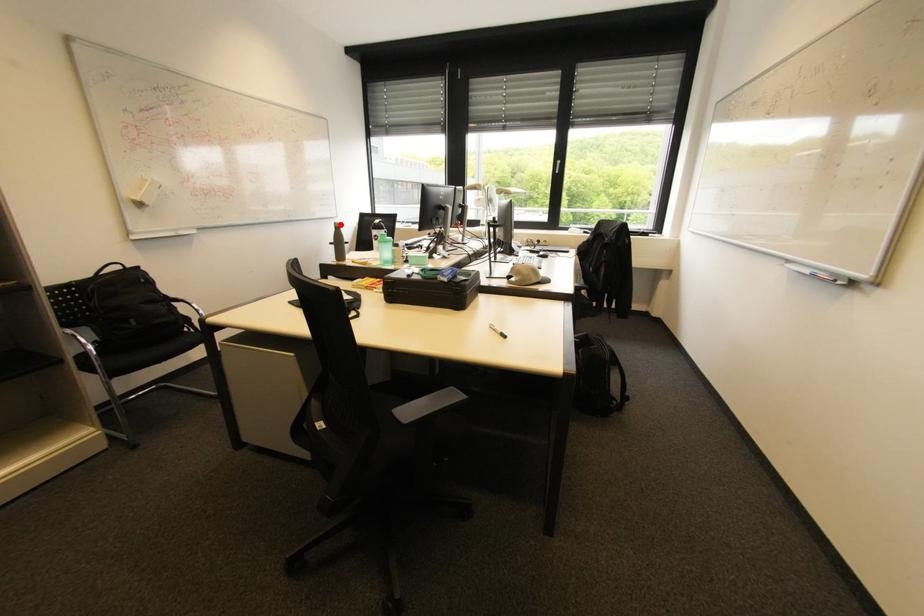
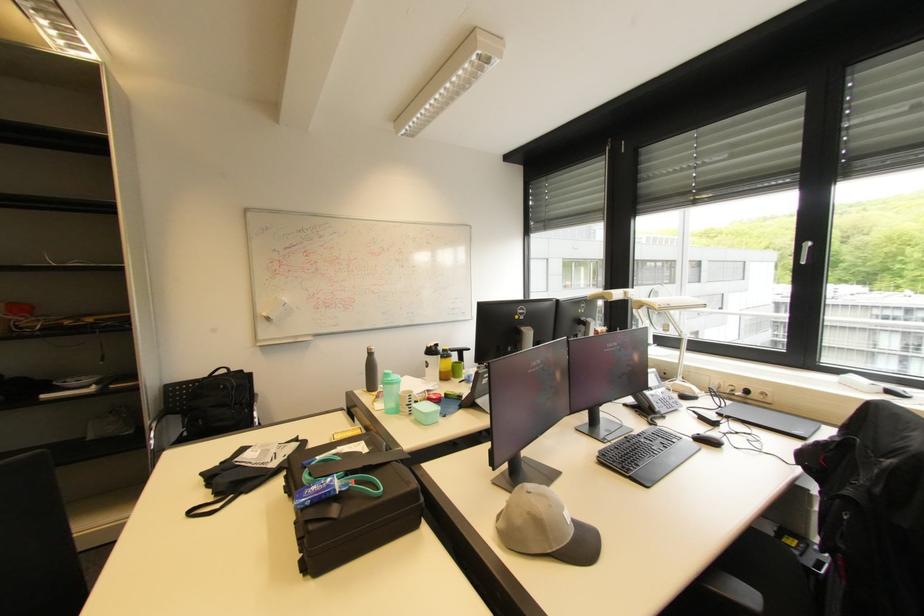
The point at the highlighted location is marked in the first image. Where is the corresponding point in the second image?

(372, 350)